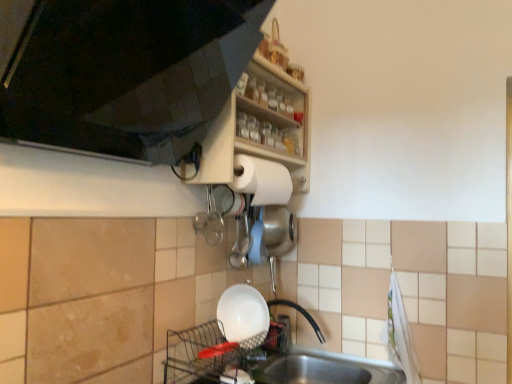
Question: From a real-world perspective, is white matte paper towel at upper center on wooden shelf at upper center?

Choices:
 (A) yes
 (B) no

Answer: (B)

Question: Is white matte paper towel at upper center further to camera compared to wooden shelf at upper center?

Choices:
 (A) yes
 (B) no

Answer: (A)

Question: Can you confirm if white matte paper towel at upper center is shorter than wooden shelf at upper center?

Choices:
 (A) no
 (B) yes

Answer: (B)

Question: From the image's perspective, would you say white matte paper towel at upper center is positioned over wooden shelf at upper center?

Choices:
 (A) yes
 (B) no

Answer: (B)

Question: Is white matte paper towel at upper center at the left side of wooden shelf at upper center?

Choices:
 (A) yes
 (B) no

Answer: (A)

Question: From a real-world perspective, is matte wood shelf at upper center above or below white matte paper towel at upper center?

Choices:
 (A) above
 (B) below

Answer: (A)

Question: Looking at the image, does matte wood shelf at upper center seem bigger or smaller compared to white matte paper towel at upper center?

Choices:
 (A) small
 (B) big

Answer: (B)

Question: From the image's perspective, relative to white matte paper towel at upper center, is matte wood shelf at upper center above or below?

Choices:
 (A) above
 (B) below

Answer: (A)

Question: Based on their positions, is matte wood shelf at upper center located to the left or right of white matte paper towel at upper center?

Choices:
 (A) left
 (B) right

Answer: (A)

Question: In terms of width, does white matte paper towel at upper center look wider or thinner when compared to white glossy bowl at lower center?

Choices:
 (A) thin
 (B) wide

Answer: (A)

Question: Is white matte paper towel at upper center situated inside white glossy bowl at lower center or outside?

Choices:
 (A) inside
 (B) outside

Answer: (B)

Question: Is white matte paper towel at upper center bigger or smaller than white glossy bowl at lower center?

Choices:
 (A) small
 (B) big

Answer: (B)

Question: In the image, is white matte paper towel at upper center on the left side or the right side of white glossy bowl at lower center?

Choices:
 (A) right
 (B) left

Answer: (A)

Question: Considering the positions of point (31, 6) and point (244, 304), is point (31, 6) closer or farther from the camera than point (244, 304)?

Choices:
 (A) farther
 (B) closer

Answer: (B)

Question: Based on their sizes in the image, would you say matte wood shelf at upper center is bigger or smaller than white glossy bowl at lower center?

Choices:
 (A) big
 (B) small

Answer: (A)